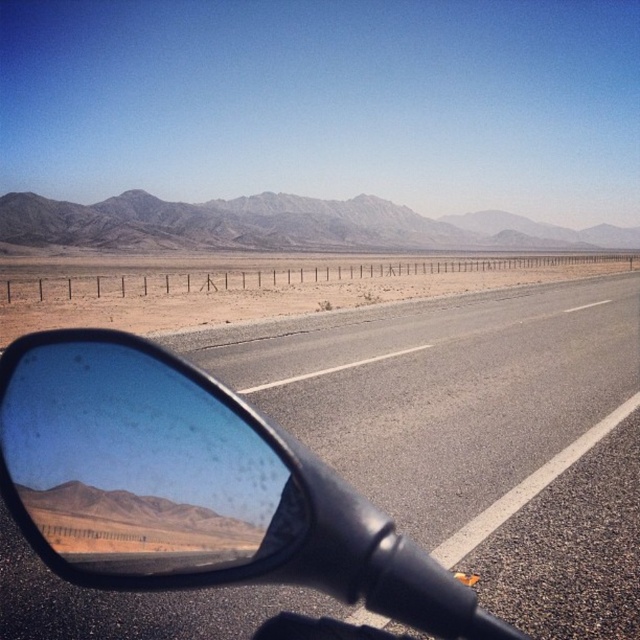
Question: Which of the following is the farthest from the observer?

Choices:
 (A) glossy black mirror at lower left
 (B) gray rocky mountain at upper center

Answer: (B)

Question: Which point appears farthest from the camera in this image?

Choices:
 (A) (20, 237)
 (B) (65, 444)

Answer: (A)

Question: Where is glossy black mirror at lower left located in relation to gray rocky mountain at upper center in the image?

Choices:
 (A) right
 (B) left

Answer: (B)

Question: Among these points, which one is farthest from the camera?

Choices:
 (A) pyautogui.click(x=163, y=520)
 (B) pyautogui.click(x=138, y=189)

Answer: (B)

Question: Can you confirm if glossy black mirror at lower left is thinner than gray rocky mountain at upper center?

Choices:
 (A) yes
 (B) no

Answer: (A)

Question: Can you confirm if asphalt road at center is positioned below glossy black mirror at lower left?

Choices:
 (A) no
 (B) yes

Answer: (A)